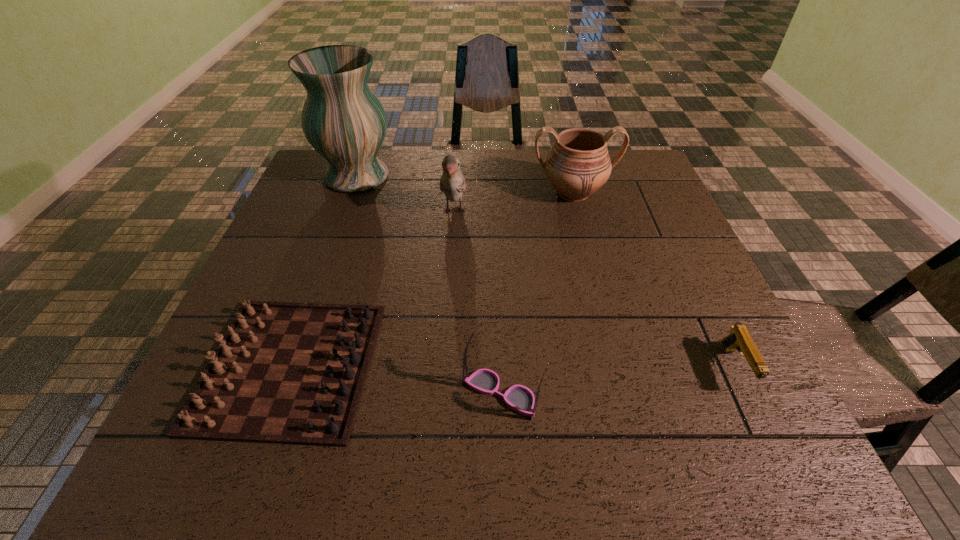
This screenshot has width=960, height=540. What are the coordinates of `free location that satisfies the following two spatial constraints: 1. at the face of the spectacles; 2. on the right side of the third object from left to right` in the screenshot? It's located at (442, 394).